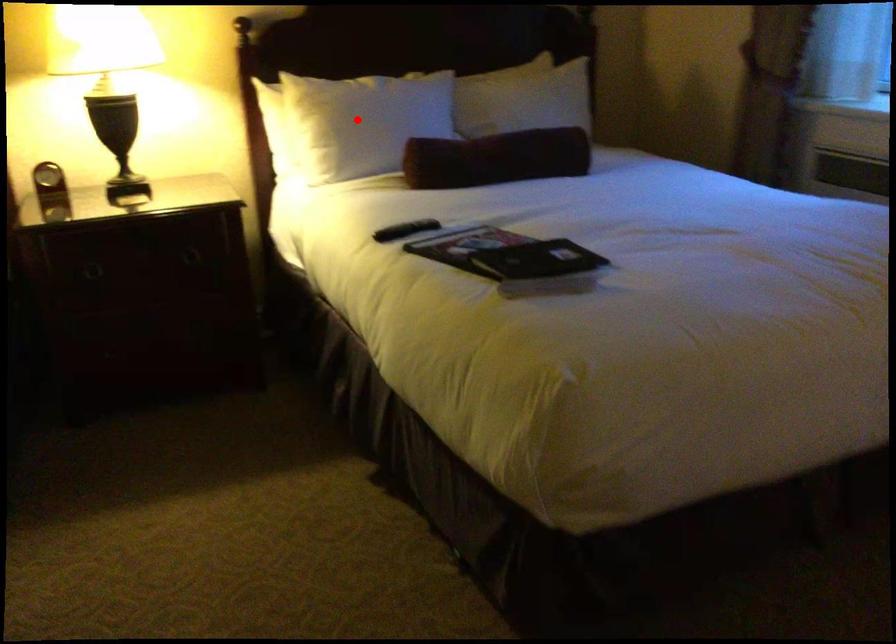
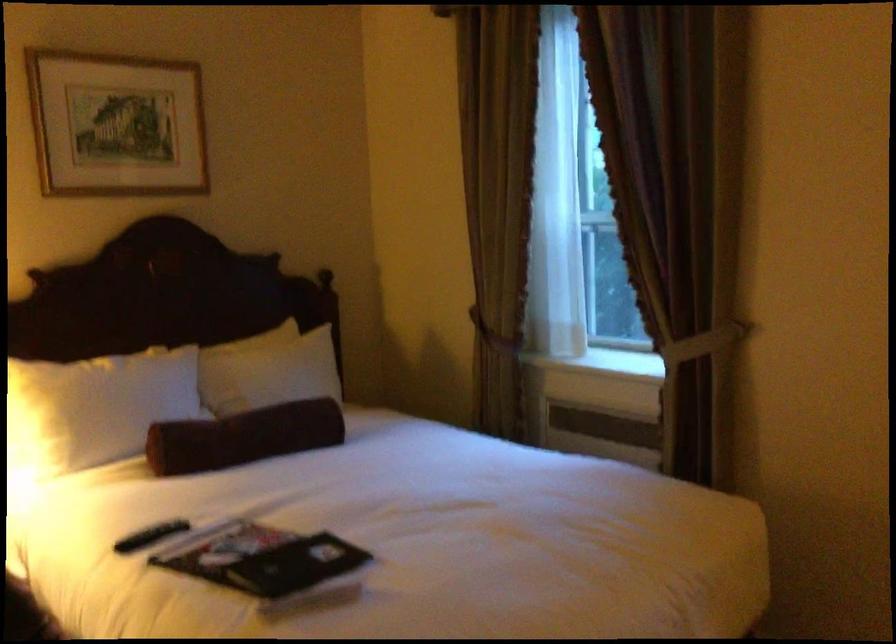
In the second image, find the point that corresponds to the highlighted location in the first image.

(95, 408)